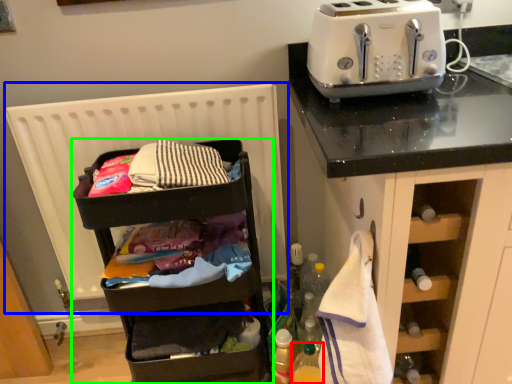
Question: Considering the real-world distances, which object is farthest from bottle (highlighted by a red box)? radiator (highlighted by a blue box) or shelf (highlighted by a green box)?

Choices:
 (A) radiator
 (B) shelf

Answer: (A)